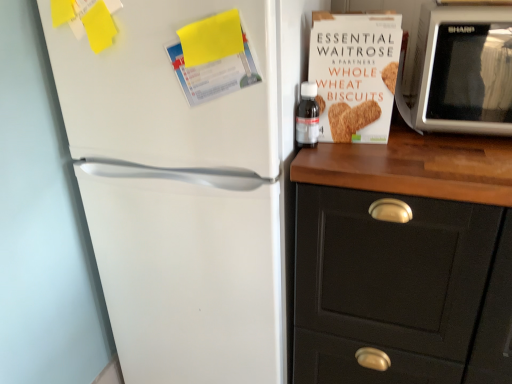
Question: From a real-world perspective, is black matte cabinet at right under transparent plastic bottle at upper right?

Choices:
 (A) no
 (B) yes

Answer: (B)

Question: Is transparent plastic bottle at upper right at the back of black matte cabinet at right?

Choices:
 (A) no
 (B) yes

Answer: (A)

Question: Considering the relative sizes of black matte cabinet at right and transparent plastic bottle at upper right in the image provided, is black matte cabinet at right shorter than transparent plastic bottle at upper right?

Choices:
 (A) no
 (B) yes

Answer: (A)

Question: Does black matte cabinet at right come behind transparent plastic bottle at upper right?

Choices:
 (A) yes
 (B) no

Answer: (B)

Question: Is black matte cabinet at right completely or partially outside of transparent plastic bottle at upper right?

Choices:
 (A) yes
 (B) no

Answer: (A)

Question: Is black matte cabinet at right with transparent plastic bottle at upper right?

Choices:
 (A) no
 (B) yes

Answer: (A)

Question: From the image's perspective, is black matte cabinet at right above white matte refrigerator at left?

Choices:
 (A) yes
 (B) no

Answer: (B)

Question: Is black matte cabinet at right at the right side of white matte refrigerator at left?

Choices:
 (A) yes
 (B) no

Answer: (A)

Question: Can you confirm if black matte cabinet at right is thinner than white matte refrigerator at left?

Choices:
 (A) no
 (B) yes

Answer: (B)

Question: From a real-world perspective, is black matte cabinet at right located higher than white matte refrigerator at left?

Choices:
 (A) yes
 (B) no

Answer: (B)

Question: Considering the relative sizes of black matte cabinet at right and white matte refrigerator at left in the image provided, is black matte cabinet at right wider than white matte refrigerator at left?

Choices:
 (A) no
 (B) yes

Answer: (A)

Question: From the image's perspective, is black matte cabinet at right below white matte refrigerator at left?

Choices:
 (A) no
 (B) yes

Answer: (B)

Question: Considering the relative sizes of white cardboard box of whole wheat biscuits at upper right and black matte cabinet at right in the image provided, is white cardboard box of whole wheat biscuits at upper right thinner than black matte cabinet at right?

Choices:
 (A) no
 (B) yes

Answer: (B)